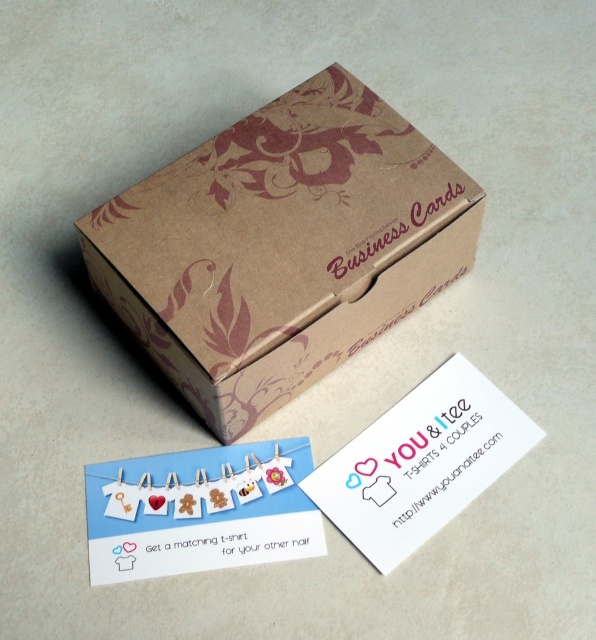
Question: Which point appears farthest from the camera in this image?

Choices:
 (A) (473, 448)
 (B) (92, 564)

Answer: (A)

Question: Is cardboard paper card at center closer to the viewer compared to white paper business card at center?

Choices:
 (A) yes
 (B) no

Answer: (A)

Question: Which object is closer to the camera taking this photo?

Choices:
 (A) cardboard paper card at center
 (B) brown kraft paper business cards at center

Answer: (B)

Question: Can you confirm if brown kraft paper business cards at center is bigger than cardboard paper card at center?

Choices:
 (A) no
 (B) yes

Answer: (B)

Question: Is brown kraft paper business cards at center wider than white paper business card at center?

Choices:
 (A) no
 (B) yes

Answer: (B)

Question: Based on their relative distances, which object is farther from the cardboard paper card at center?

Choices:
 (A) white paper business card at center
 (B) brown kraft paper business cards at center

Answer: (B)